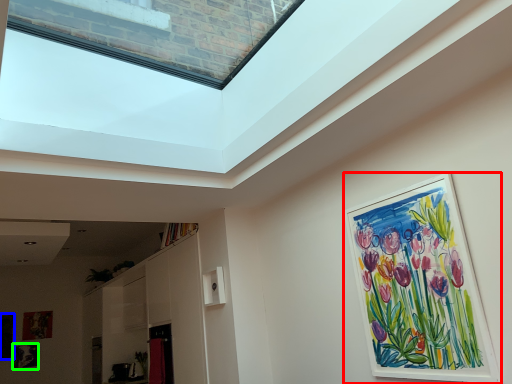
Question: Which is nearer to the picture frame (highlighted by a red box)? picture frame (highlighted by a blue box) or picture frame (highlighted by a green box).

Choices:
 (A) picture frame
 (B) picture frame

Answer: (B)